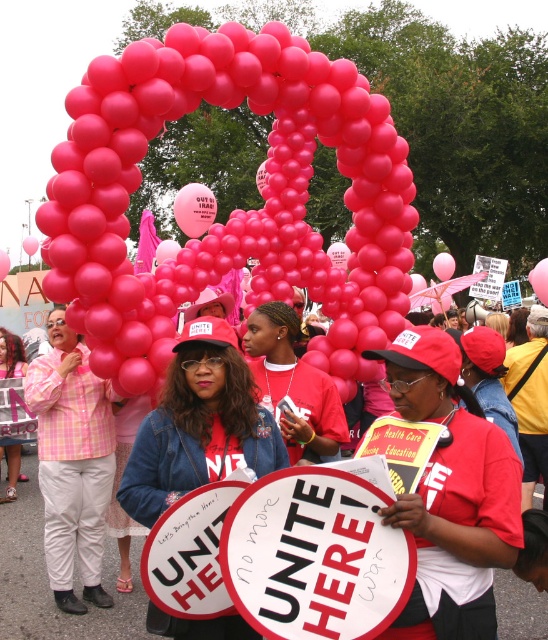
Question: Is white paper sign at center above matte pink shirt at center?

Choices:
 (A) no
 (B) yes

Answer: (B)

Question: Which point appears closest to the camera in this image?

Choices:
 (A) (259, 84)
 (B) (9, 476)
 (C) (185, 472)

Answer: (C)

Question: Can you confirm if pink balloons at center is thinner than matte red shirt at center?

Choices:
 (A) yes
 (B) no

Answer: (A)

Question: Which object is positioned closest to the white paper sign at center?

Choices:
 (A) matte pink shirt at center
 (B) matte red shirt at center

Answer: (B)

Question: Which point is farther from the camera taking this photo?

Choices:
 (A) (203, 40)
 (B) (232, 364)
 (C) (15, 497)
 (D) (317, 513)

Answer: (C)

Question: Does pink balloons at center have a smaller size compared to matte red shirt at center?

Choices:
 (A) yes
 (B) no

Answer: (A)